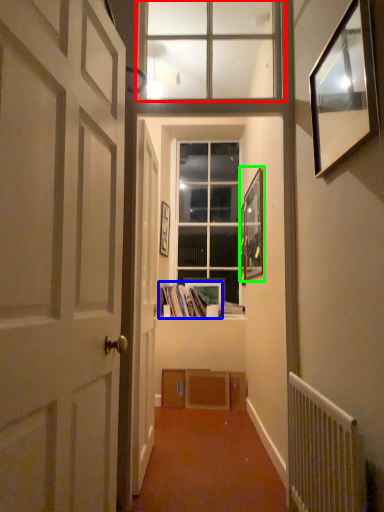
Question: Estimate the real-world distances between objects in this image. Which object is closer to window (highlighted by a red box), book (highlighted by a blue box) or picture frame (highlighted by a green box)?

Choices:
 (A) book
 (B) picture frame

Answer: (B)